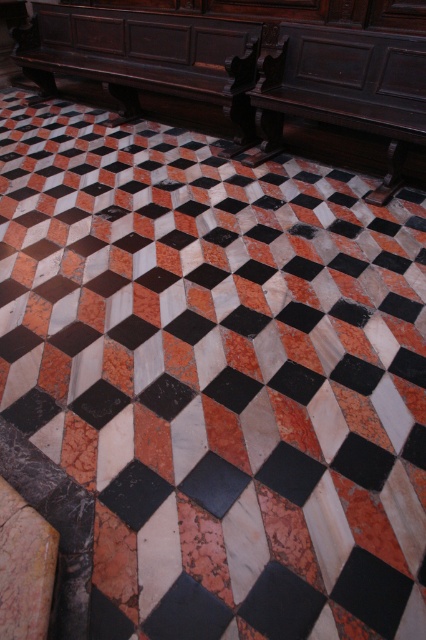
You are a visitor in a room with the described floor pattern. You see a dark wood bench at center and a dark polished wood bench at upper right. Which bench is larger in size?

The dark wood bench at center is bigger than the dark polished wood bench at upper right.

You are a painter who needs to place a large canvas between the polished dark wood bench at center and the dark polished wood bench at upper right. Which bench should you move to make space for the canvas?

The polished dark wood bench at center has a greater width than the dark polished wood bench at upper right, so moving the polished dark wood bench at center would create more space for the canvas.

You are standing at the entrance of the room looking towards the center. There are two benches in the room. One is the dark wood bench at center and the other is the dark polished wood bench at upper right. Which bench is closer to you?

The dark wood bench at center is closer to you because the dark polished wood bench at upper right is behind it.